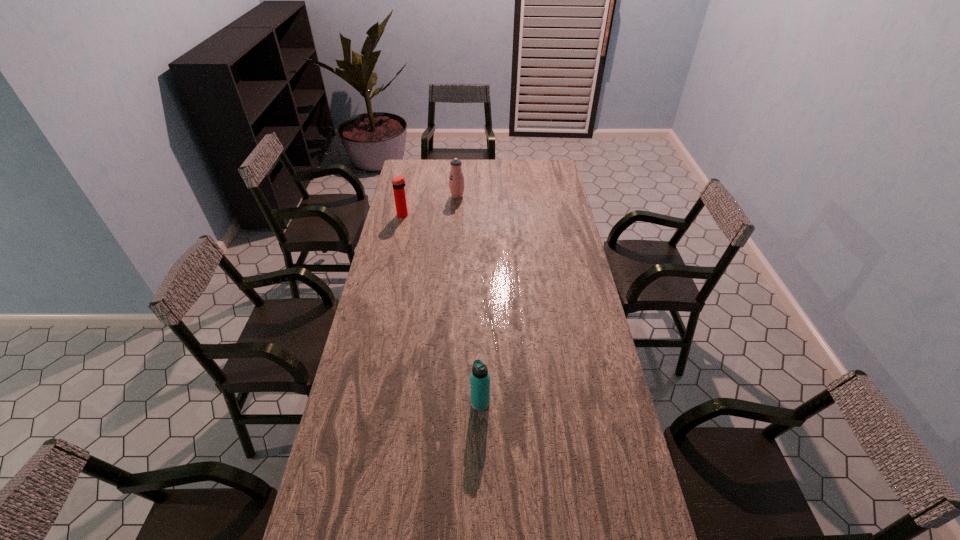
I want to click on free space at the far edge of the desktop, so click(479, 170).

In the image, there is a desktop. Where is `free space at the left edge`? The height and width of the screenshot is (540, 960). free space at the left edge is located at coordinates (367, 323).

Identify the location of vacant space at the right edge. The image size is (960, 540). (568, 242).

In the image, there is a desktop. Where is `vacant space at the far left corner`? Image resolution: width=960 pixels, height=540 pixels. vacant space at the far left corner is located at coordinates (416, 163).

At what (x,y) coordinates should I click in order to perform the action: click on vacant area that lies between the nearest thermos bottle and the leftmost object. Please return your answer as a coordinate pair (x, y). Looking at the image, I should click on tap(442, 309).

Identify the location of free space between the second farthest thermos bottle and the rightmost thermos bottle. (442, 309).

I want to click on empty location between the rightmost thermos bottle and the farthest thermos bottle, so click(x=468, y=299).

Where is `free space between the nearest thermos bottle and the second object from left to right`? The width and height of the screenshot is (960, 540). free space between the nearest thermos bottle and the second object from left to right is located at coordinates (468, 299).

Find the location of a particular element. free space between the second farthest object and the second object from left to right is located at coordinates (430, 205).

Find the location of `vacant region between the second nearest thermos bottle and the second thermos bottle from right to left`. vacant region between the second nearest thermos bottle and the second thermos bottle from right to left is located at coordinates (430, 205).